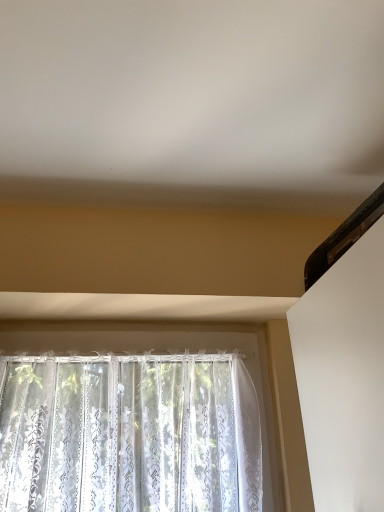
Image resolution: width=384 pixels, height=512 pixels. What do you see at coordinates (129, 435) in the screenshot?
I see `white lace curtain at lower left` at bounding box center [129, 435].

I want to click on white lace curtain at lower left, so tap(129, 435).

Where is `white lace curtain at lower left`? The height and width of the screenshot is (512, 384). white lace curtain at lower left is located at coordinates (129, 435).